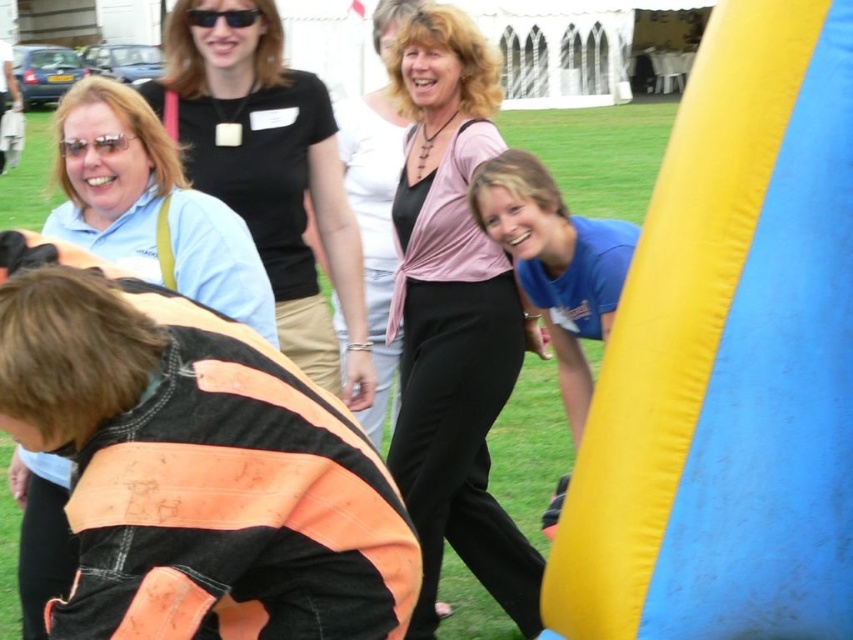
Question: In this image, where is matte black shirt at upper left located relative to blue cotton shirt at lower right?

Choices:
 (A) below
 (B) above

Answer: (B)

Question: Which object appears closest to the camera in this image?

Choices:
 (A) pink fabric top at center
 (B) matte black shirt at upper left

Answer: (B)

Question: Which point is farther to the camera?

Choices:
 (A) (141, 193)
 (B) (438, 497)
 (C) (242, 33)
 (D) (538, 296)

Answer: (C)

Question: Can you confirm if matte black shirt at upper left is wider than blue cotton shirt at lower right?

Choices:
 (A) no
 (B) yes

Answer: (B)

Question: Estimate the real-world distances between objects in this image. Which object is closer to the pink fabric top at center?

Choices:
 (A) blue cotton shirt at lower right
 (B) matte black shirt at upper left

Answer: (A)

Question: Can you confirm if light blue shirt at upper left is smaller than blue cotton shirt at lower right?

Choices:
 (A) no
 (B) yes

Answer: (A)